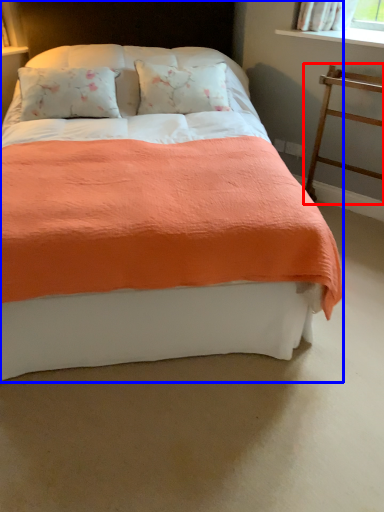
Question: Which of the following is the closest to the observer, balustrade (highlighted by a red box) or bed (highlighted by a blue box)?

Choices:
 (A) balustrade
 (B) bed

Answer: (B)